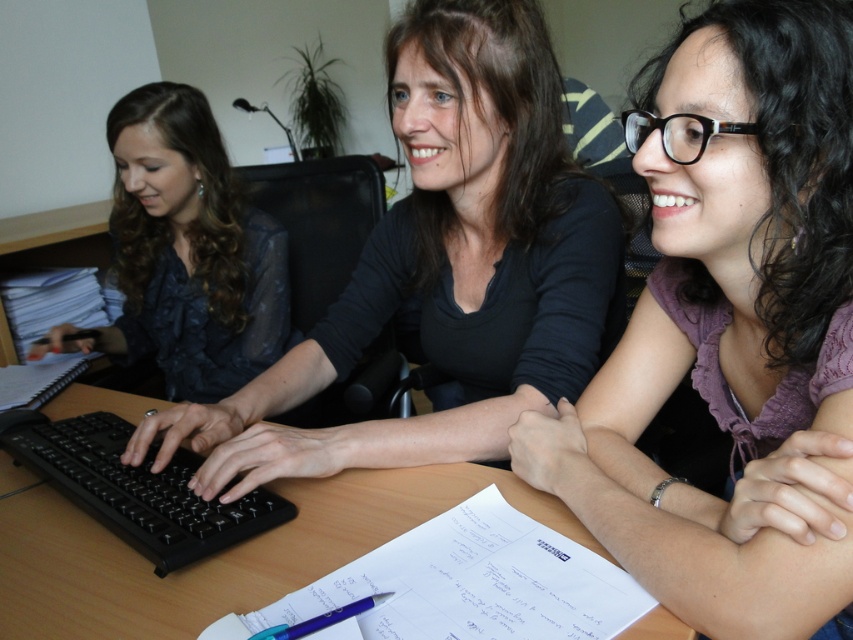
You are organizing a desk and need to place a new item between the purple fabric shirt at center and the blue plastic pen at lower center. Based on their positions, where should you place the new item?

The purple fabric shirt at center is to the right of the blue plastic pen at lower center, so you should place the new item between them, to the right of the blue plastic pen at lower center and to the left of the purple fabric shirt at center.

You are a delivery person who needs to place a small package between the person wearing a matte black shirt at center and the person with curly black hair and glasses. The package is 30 inches long. Can you fit it between them?

The distance between the matte black shirt at center and the person with curly black hair and glasses is 29.97 inches. Since the package is 30 inches long, it cannot fit between them as there is not enough space.